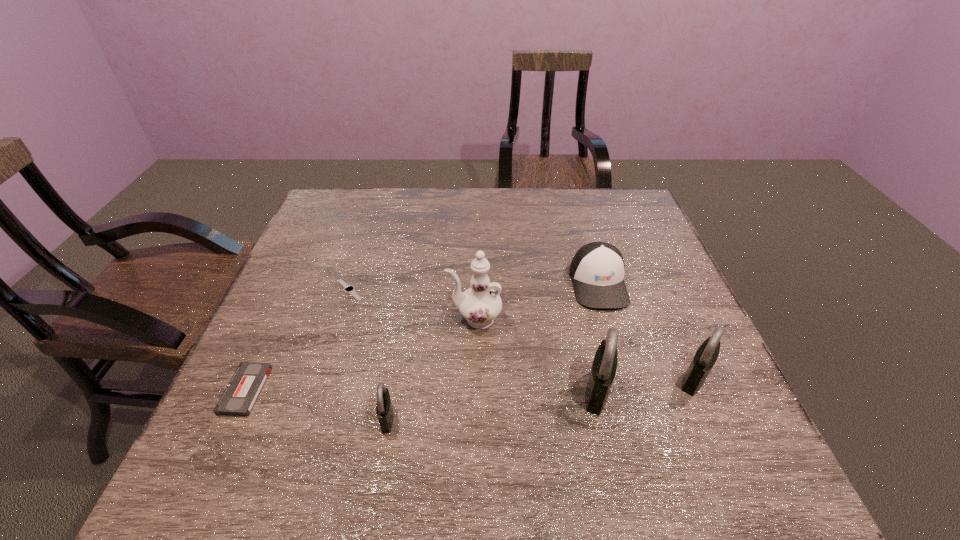
At what (x,y) coordinates should I click in order to perform the action: click on the sixth tallest object. Please return your answer as a coordinate pair (x, y). This screenshot has width=960, height=540. Looking at the image, I should click on (239, 397).

Locate an element on the screen. the leftmost object is located at coordinates (239, 397).

You are a GUI agent. You are given a task and a screenshot of the screen. Output one action in this format:
    pyautogui.click(x=<x>, y=<y>)
    Task: Click on the free point located on the right of the leftmost padlock
    
    Given the screenshot: What is the action you would take?
    pyautogui.click(x=440, y=418)

Locate an element on the screen. This screenshot has width=960, height=540. free point located on the left of the second padlock from right to left is located at coordinates (491, 391).

The width and height of the screenshot is (960, 540). What are the coordinates of `vacant area located on the left of the rightmost object` in the screenshot? It's located at (559, 379).

Image resolution: width=960 pixels, height=540 pixels. What are the coordinates of `vacant area situated 0.390m on the right of the sixth object from right to left` in the screenshot? It's located at (516, 291).

In order to click on vacant space located 0.140m at the spout of the tallest object in this screenshot , I will do `click(390, 319)`.

You are a GUI agent. You are given a task and a screenshot of the screen. Output one action in this format:
    pyautogui.click(x=<x>, y=<y>)
    Task: Click on the vacant space situated 0.260m at the spout of the tallest object
    This screenshot has width=960, height=540.
    Given the screenshot: What is the action you would take?
    pyautogui.click(x=340, y=319)

Image resolution: width=960 pixels, height=540 pixels. What are the coordinates of `vacant space located 0.170m at the spout of the tallest object` in the screenshot? It's located at (377, 319).

Locate an element on the screen. vacant space located on the front panel of the cap is located at coordinates (622, 366).